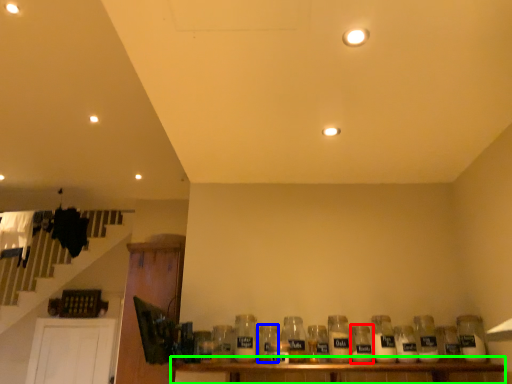
Question: Based on their relative distances, which object is nearer to bottle (highlighted by a red box)? Choose from bottle (highlighted by a blue box) and table (highlighted by a green box).

Choices:
 (A) bottle
 (B) table

Answer: (B)